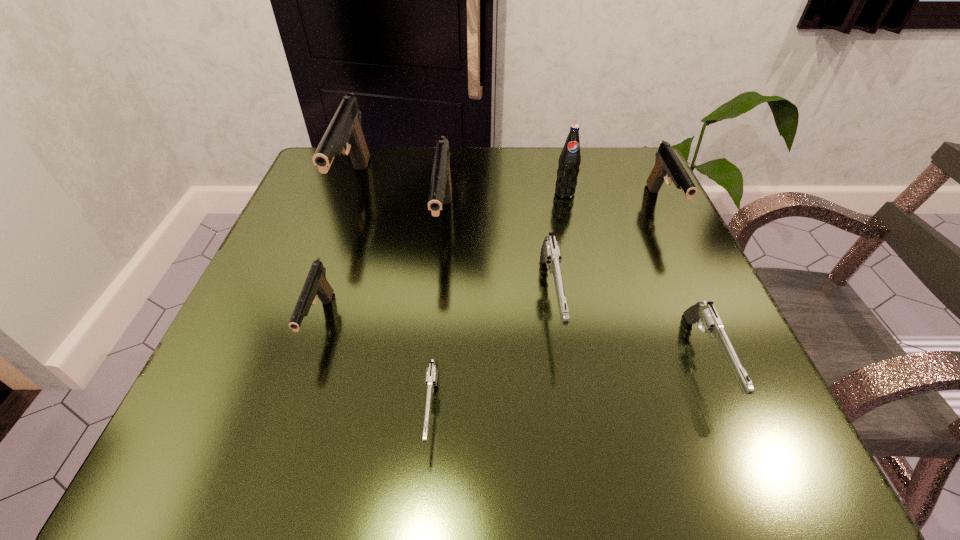
I want to click on vacant space at the far right corner of the desktop, so click(x=609, y=193).

Identify the location of vacant space that's between the tallest pistol and the nearest black pistol. Image resolution: width=960 pixels, height=540 pixels. (337, 256).

Where is `vacant area between the smallest black pistol and the seventh object from left to right`? The image size is (960, 540). vacant area between the smallest black pistol and the seventh object from left to right is located at coordinates tap(513, 342).

Find the location of a particular element. vacant point located between the third smallest black pistol and the rightmost object is located at coordinates tap(553, 215).

This screenshot has width=960, height=540. What are the coordinates of `unoccupied position between the rightmost object and the sixth shortest pistol` in the screenshot? It's located at (553, 215).

You are a GUI agent. You are given a task and a screenshot of the screen. Output one action in this format:
    pyautogui.click(x=<x>, y=<y>)
    Task: Click on the vacant area between the tallest pistol and the second smallest silver pistol
    This screenshot has height=540, width=960.
    Given the screenshot: What is the action you would take?
    tap(530, 275)

You are a GUI agent. You are given a task and a screenshot of the screen. Output one action in this format:
    pyautogui.click(x=<x>, y=<y>)
    Task: Click on the free space between the third smallest black pistol and the smallest black pistol
    The height and width of the screenshot is (540, 960).
    Given the screenshot: What is the action you would take?
    pyautogui.click(x=382, y=273)

In order to click on empty space that is in between the second silver pistol from left to right and the biggest black pistol in this screenshot , I will do `click(452, 245)`.

Identify the location of vacant area that lies between the sixth shortest pistol and the smallest silver pistol. The width and height of the screenshot is (960, 540). (438, 316).

Identify the location of vacant space that is in between the smallest silver pistol and the nearest black pistol. The height and width of the screenshot is (540, 960). (376, 366).